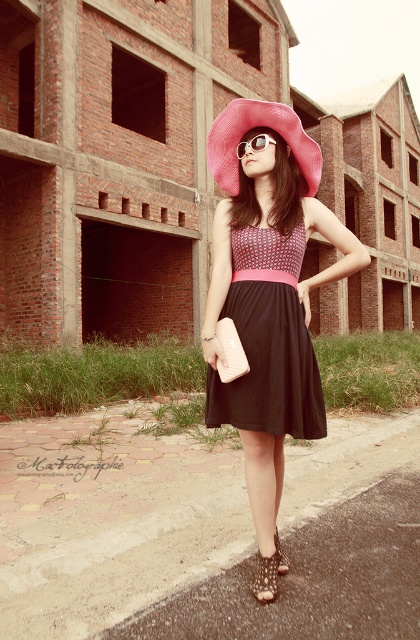
You are an architect visiting the construction site and see the leather textured sandal at lower center and the black textured sandal at lower center. Which sandal is positioned lower in the image?

The leather textured sandal at lower center is located below the black textured sandal at lower center, so it is positioned lower in the image.

You are a fashion stylist preparing an outfit for a client who wants to wear either the leather textured sandal at lower center or the black textured sandal at lower center with their outfit. The client mentions they have wide feet and need a sandal with more room. Based on the image, which sandal would you recommend?

The leather textured sandal at lower center might be wider than black textured sandal at lower center, so it would be more suitable for someone with wide feet.

From the picture: You are a drone operator trying to capture aerial footage of the unfinished building. You have two points marked on your map for drone navigation. The first point is at point (260, 566) and the second is at point (283, 557). If you fly the drone from the first point to the second, will it move closer to or farther from the building?

The drone will move closer to the building because point (260, 566) is in front of point (283, 557), meaning the second point is behind the first relative to the building.